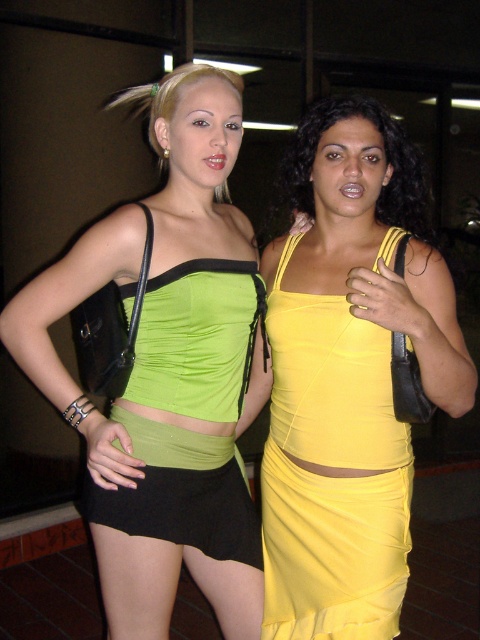
You are a photographer trying to capture a clear photo of both the green matte fabric top at center and the green satin dress at center. Which one will appear closer to the camera in the photo?

The green matte fabric top at center will appear closer to the camera because it is positioned in front of the green satin dress at center.

You are a photographer standing at a certain distance from the two women. You want to focus on a specific point in the image to ensure the background is blurred. The point you need to focus on is located at coordinates point (311,600). Given that the depth of field requires the focus point to be within 5 feet from the camera to achieve the desired blur, will focusing at this point work?

The distance of point (311,600) from camera is 4.96 feet, which is within the required 5 feet depth of field. Therefore, focusing at this point will achieve the desired background blur.